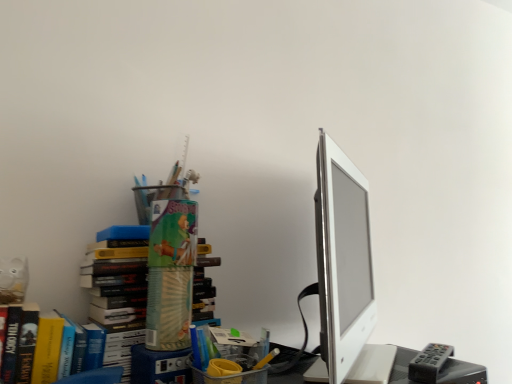
Where is `gray plastic remote at lower right`? gray plastic remote at lower right is located at coordinates (429, 363).

You are a GUI agent. You are given a task and a screenshot of the screen. Output one action in this format:
    pyautogui.click(x=<x>, y=<y>)
    Task: Click on the white glossy computer monitor at right
    
    Given the screenshot: What is the action you would take?
    pyautogui.click(x=345, y=274)

You are a GUI agent. You are given a task and a screenshot of the screen. Output one action in this format:
    pyautogui.click(x=<x>, y=<y>)
    Task: Click on the smooth plastic desk at lower right
    Image resolution: width=512 pixels, height=384 pixels.
    Given the screenshot: What is the action you would take?
    pyautogui.click(x=461, y=373)

Are smooth plastic desk at lower right and gray plastic remote at lower right beside each other?

Yes, smooth plastic desk at lower right is right next to gray plastic remote at lower right and making contact.

Based on the photo, is smooth plastic desk at lower right located outside gray plastic remote at lower right?

Absolutely, smooth plastic desk at lower right is external to gray plastic remote at lower right.

Looking at the image, does smooth plastic desk at lower right seem bigger or smaller compared to gray plastic remote at lower right?

Considering their sizes, smooth plastic desk at lower right takes up more space than gray plastic remote at lower right.

Considering the relative sizes of smooth plastic desk at lower right and gray plastic remote at lower right in the image provided, is smooth plastic desk at lower right shorter than gray plastic remote at lower right?

No, smooth plastic desk at lower right is not shorter than gray plastic remote at lower right.

The image size is (512, 384). In order to click on stationery that appears on the right of white glossy computer monitor at right in this screenshot , I will do `click(429, 363)`.

Which is behind, point (345, 299) or point (431, 353)?

The point (345, 299) is behind.

From their relative heights in the image, would you say white glossy computer monitor at right is taller or shorter than gray plastic remote at lower right?

In the image, white glossy computer monitor at right appears to be taller than gray plastic remote at lower right.

Considering the sizes of objects white glossy computer monitor at right and gray plastic remote at lower right in the image provided, who is wider, white glossy computer monitor at right or gray plastic remote at lower right?

Wider between the two is white glossy computer monitor at right.

Can you confirm if gray plastic remote at lower right is shorter than white glossy computer monitor at right?

Yes, gray plastic remote at lower right is shorter than white glossy computer monitor at right.

Which is behind, point (446, 353) or point (358, 188)?

Point (358, 188)

Consider the image. Is the position of gray plastic remote at lower right less distant than that of white glossy computer monitor at right?

No, it is behind white glossy computer monitor at right.

Looking at this image, could you tell me if white glossy computer monitor at right is facing smooth plastic desk at lower right?

No, white glossy computer monitor at right is not facing towards smooth plastic desk at lower right.

How many degrees apart are the facing directions of white glossy computer monitor at right and smooth plastic desk at lower right?

There is a 39.7-degree angle between the facing directions of white glossy computer monitor at right and smooth plastic desk at lower right.

Where is `desk below the white glossy computer monitor at right (from a real-world perspective)`? desk below the white glossy computer monitor at right (from a real-world perspective) is located at coordinates (461, 373).

How different are the orientations of gray plastic remote at lower right and smooth plastic desk at lower right in degrees?

They differ by 27.9 degrees in their facing directions.

In terms of height, does gray plastic remote at lower right look taller or shorter compared to smooth plastic desk at lower right?

In the image, gray plastic remote at lower right appears to be shorter than smooth plastic desk at lower right.

Is gray plastic remote at lower right smaller than smooth plastic desk at lower right?

Indeed, gray plastic remote at lower right has a smaller size compared to smooth plastic desk at lower right.

Considering the relative sizes of gray plastic remote at lower right and smooth plastic desk at lower right in the image provided, is gray plastic remote at lower right thinner than smooth plastic desk at lower right?

Yes, gray plastic remote at lower right is thinner than smooth plastic desk at lower right.

From the image's perspective, who appears lower, smooth plastic desk at lower right or white glossy computer monitor at right?

smooth plastic desk at lower right is shown below in the image.

From the picture: How many degrees apart are the facing directions of smooth plastic desk at lower right and white glossy computer monitor at right?

The facing directions of smooth plastic desk at lower right and white glossy computer monitor at right are 39.7 degrees apart.

Is smooth plastic desk at lower right at the left side of white glossy computer monitor at right?

Indeed, smooth plastic desk at lower right is positioned on the left side of white glossy computer monitor at right.

In the image, is smooth plastic desk at lower right positioned in front of or behind white glossy computer monitor at right?

Clearly, smooth plastic desk at lower right is behind white glossy computer monitor at right.

Locate an element on the screen. stationery above the smooth plastic desk at lower right (from a real-world perspective) is located at coordinates (429, 363).

Identify the location of stationery below the white glossy computer monitor at right (from a real-world perspective). (429, 363).

Which object lies further to the anchor point smooth plastic desk at lower right, white glossy computer monitor at right or gray plastic remote at lower right?

Based on the image, white glossy computer monitor at right appears to be further to smooth plastic desk at lower right.

From the image, which object appears to be nearer to white glossy computer monitor at right, smooth plastic desk at lower right or gray plastic remote at lower right?

Among the two, smooth plastic desk at lower right is located nearer to white glossy computer monitor at right.

Based on their spatial positions, is smooth plastic desk at lower right or white glossy computer monitor at right closer to gray plastic remote at lower right?

Based on the image, smooth plastic desk at lower right appears to be nearer to gray plastic remote at lower right.

Which object lies nearer to the anchor point gray plastic remote at lower right, white glossy computer monitor at right or smooth plastic desk at lower right?

smooth plastic desk at lower right is positioned closer to the anchor gray plastic remote at lower right.

Which object lies nearer to the anchor point smooth plastic desk at lower right, gray plastic remote at lower right or white glossy computer monitor at right?

gray plastic remote at lower right lies closer to smooth plastic desk at lower right than the other object.

Considering their positions, is gray plastic remote at lower right positioned closer to white glossy computer monitor at right than smooth plastic desk at lower right?

smooth plastic desk at lower right lies closer to white glossy computer monitor at right than the other object.

Identify the location of stationery that lies between white glossy computer monitor at right and smooth plastic desk at lower right from top to bottom. The image size is (512, 384). (429, 363).